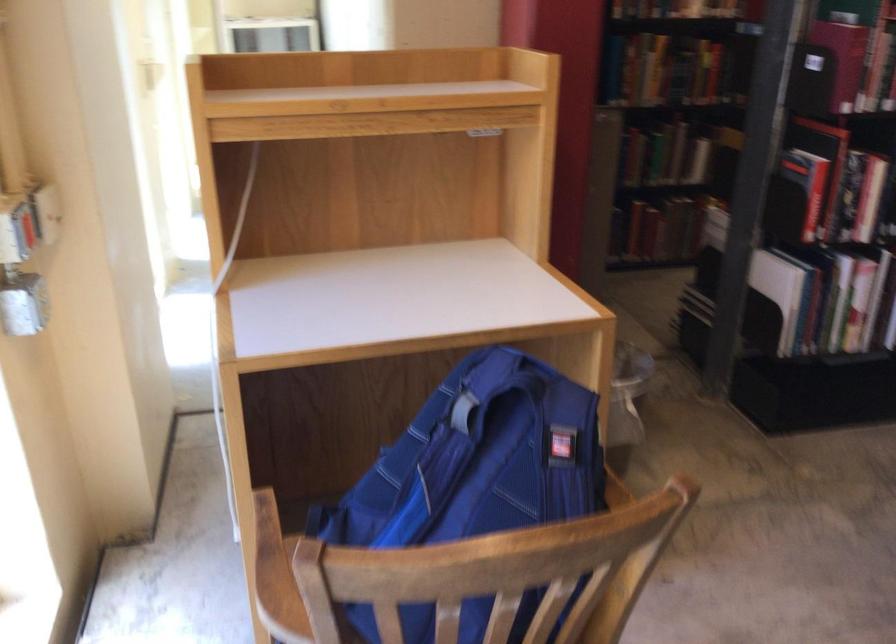
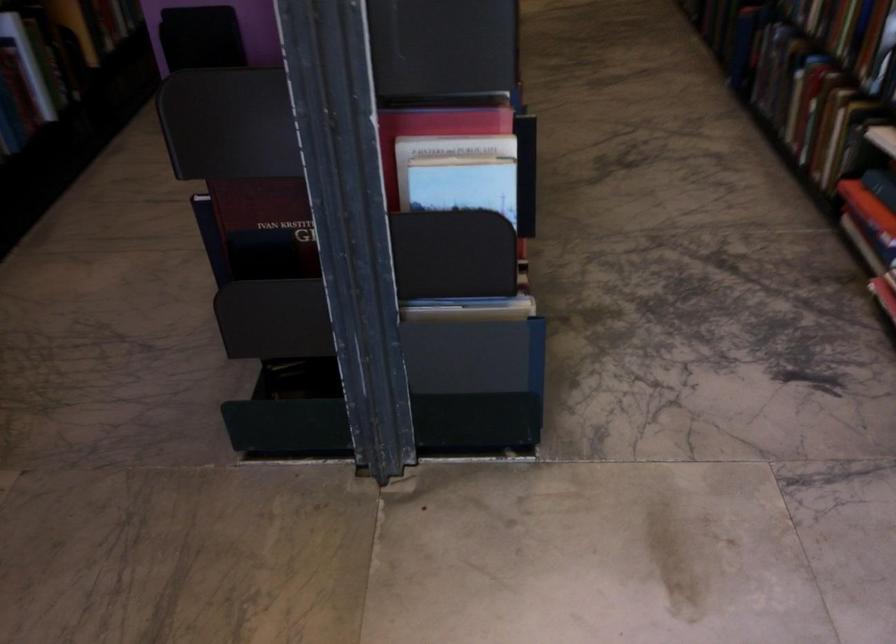
Consider the image. The first image is from the beginning of the video and the second image is from the end. How did the camera likely rotate when shooting the video?

The rotation direction of the camera is right-down.